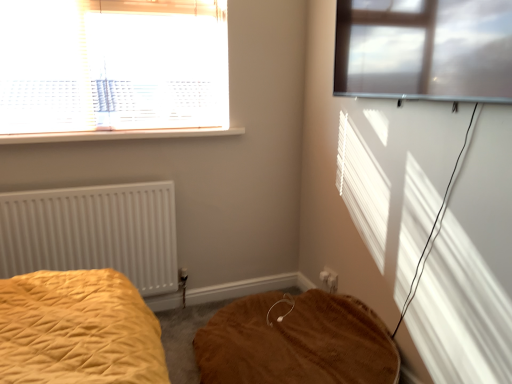
This screenshot has height=384, width=512. In order to click on free space above white matte radiator at left (from a real-world perspective) in this screenshot , I will do `click(74, 177)`.